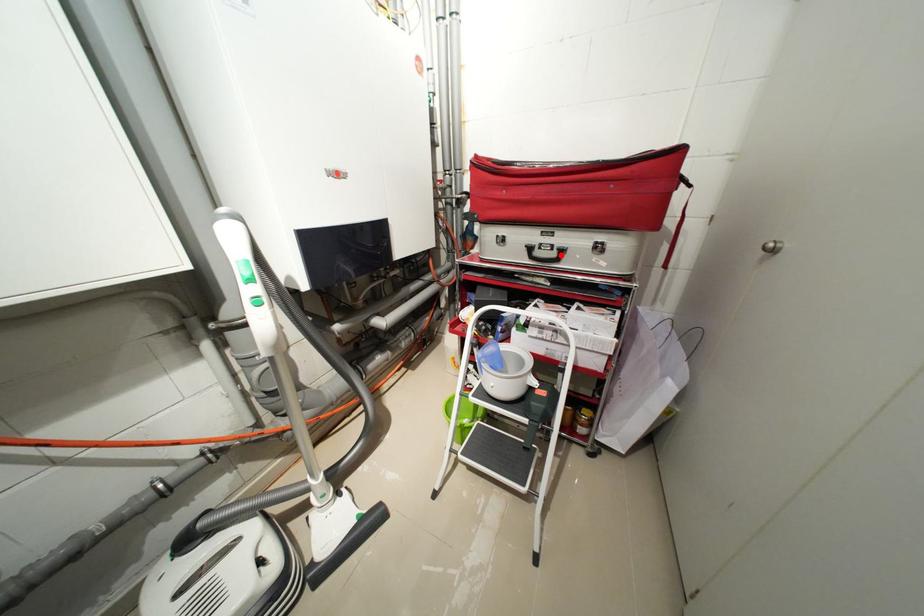
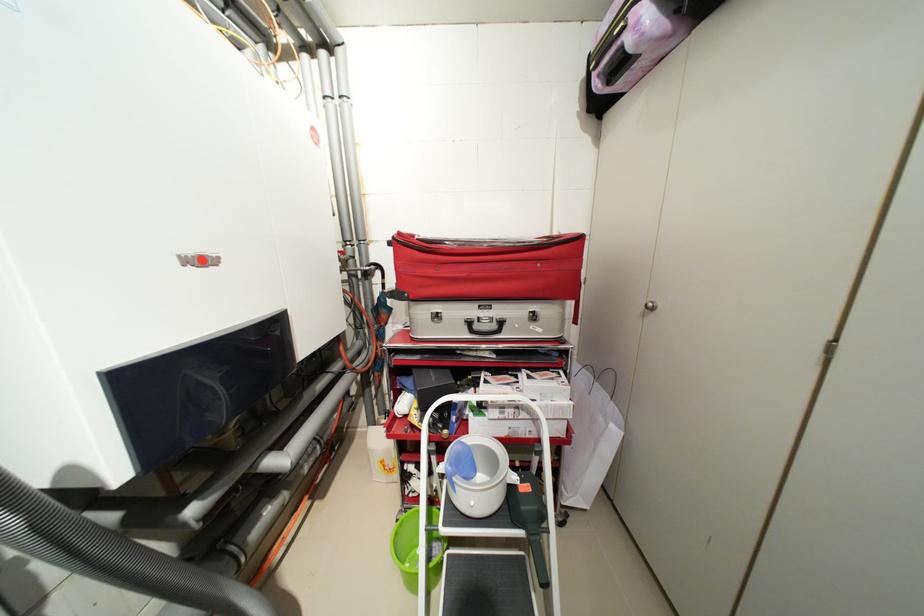
The point at the highlighted location is marked in the first image. Where is the corresponding point in the second image?

(502, 326)